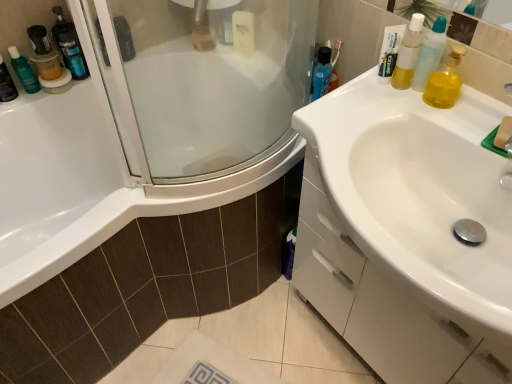
Question: Does translucent plastic mouthwash at left, placed as the 4th mouthwash when sorted from right to left, have a lesser width compared to translucent plastic mouthwash at upper left, arranged as the first mouthwash when viewed from the back?

Choices:
 (A) yes
 (B) no

Answer: (A)

Question: Is translucent plastic mouthwash at left, marked as the first mouthwash in a left-to-right arrangement, looking in the opposite direction of translucent plastic mouthwash at upper left, the 4th mouthwash when ordered from front to back?

Choices:
 (A) no
 (B) yes

Answer: (A)

Question: From the image's perspective, is translucent plastic mouthwash at left, marked as the first mouthwash in a left-to-right arrangement, over translucent plastic mouthwash at upper left, arranged as the first mouthwash when viewed from the back?

Choices:
 (A) yes
 (B) no

Answer: (B)

Question: From a real-world perspective, is translucent plastic mouthwash at left, the 2th mouthwash viewed from the back, physically above translucent plastic mouthwash at upper left, arranged as the first mouthwash when viewed from the back?

Choices:
 (A) yes
 (B) no

Answer: (A)

Question: Is translucent plastic mouthwash at left, placed as the 4th mouthwash when sorted from right to left, to the left of translucent plastic mouthwash at upper left, arranged as the first mouthwash when viewed from the back, from the viewer's perspective?

Choices:
 (A) yes
 (B) no

Answer: (A)

Question: Is translucent plastic mouthwash at left, the 2th mouthwash viewed from the back, wider than translucent plastic mouthwash at upper left, which is the third mouthwash from right to left?

Choices:
 (A) no
 (B) yes

Answer: (A)

Question: Is blue glossy mouthwash at upper right, positioned as the third mouthwash in left-to-right order, positioned behind translucent plastic mouthwash at upper right, which ranks as the fourth mouthwash in left-to-right order?

Choices:
 (A) no
 (B) yes

Answer: (B)

Question: From a real-world perspective, does blue glossy mouthwash at upper right, placed as the second mouthwash when sorted from right to left, sit lower than translucent plastic mouthwash at upper right, the first mouthwash when ordered from front to back?

Choices:
 (A) no
 (B) yes

Answer: (B)

Question: Considering the relative sizes of blue glossy mouthwash at upper right, the second mouthwash positioned from the front, and translucent plastic mouthwash at upper right, which ranks as the fourth mouthwash in left-to-right order, in the image provided, is blue glossy mouthwash at upper right, the second mouthwash positioned from the front, smaller than translucent plastic mouthwash at upper right, which ranks as the fourth mouthwash in left-to-right order,?

Choices:
 (A) no
 (B) yes

Answer: (B)

Question: Considering the relative sizes of blue glossy mouthwash at upper right, positioned as the third mouthwash in left-to-right order, and translucent plastic mouthwash at upper right, which ranks as the fourth mouthwash in left-to-right order, in the image provided, is blue glossy mouthwash at upper right, positioned as the third mouthwash in left-to-right order, bigger than translucent plastic mouthwash at upper right, which ranks as the fourth mouthwash in left-to-right order,?

Choices:
 (A) no
 (B) yes

Answer: (A)

Question: From the image's perspective, is blue glossy mouthwash at upper right, placed as the second mouthwash when sorted from right to left, on top of translucent plastic mouthwash at upper right, which ranks as the fourth mouthwash in left-to-right order?

Choices:
 (A) yes
 (B) no

Answer: (A)

Question: From a real-world perspective, is blue glossy mouthwash at upper right, the second mouthwash positioned from the front, located higher than translucent plastic mouthwash at upper right, which ranks as the fourth mouthwash in left-to-right order?

Choices:
 (A) no
 (B) yes

Answer: (A)

Question: Can we say translucent plastic mouthwash at upper right, the first mouthwash when ordered from front to back, lies outside translucent plastic mouthwash at left, placed as the 4th mouthwash when sorted from right to left?

Choices:
 (A) no
 (B) yes

Answer: (B)